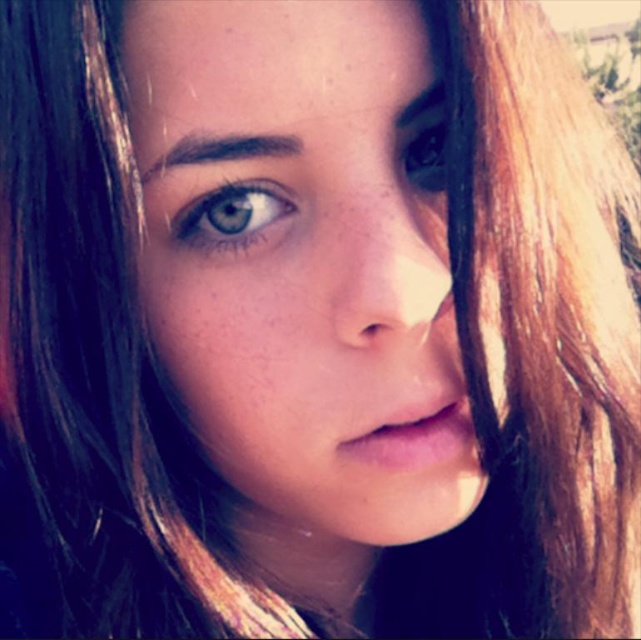
Question: Can you confirm if smooth skin face at center is wider than shiny brown eye at upper right?

Choices:
 (A) no
 (B) yes

Answer: (B)

Question: Observing the image, what is the correct spatial positioning of smooth skin face at center in reference to blue glossy eye at center?

Choices:
 (A) left
 (B) right

Answer: (B)

Question: Which object is positioned farthest from the blue glossy eye at center?

Choices:
 (A) smooth skin face at center
 (B) shiny brown eye at upper right

Answer: (B)

Question: Is smooth skin face at center above blue glossy eye at center?

Choices:
 (A) no
 (B) yes

Answer: (A)

Question: Which point is closer to the camera?

Choices:
 (A) (431, 180)
 (B) (279, 188)

Answer: (B)

Question: Based on their relative distances, which object is nearer to the smooth skin face at center?

Choices:
 (A) blue glossy eye at center
 (B) shiny brown eye at upper right

Answer: (A)